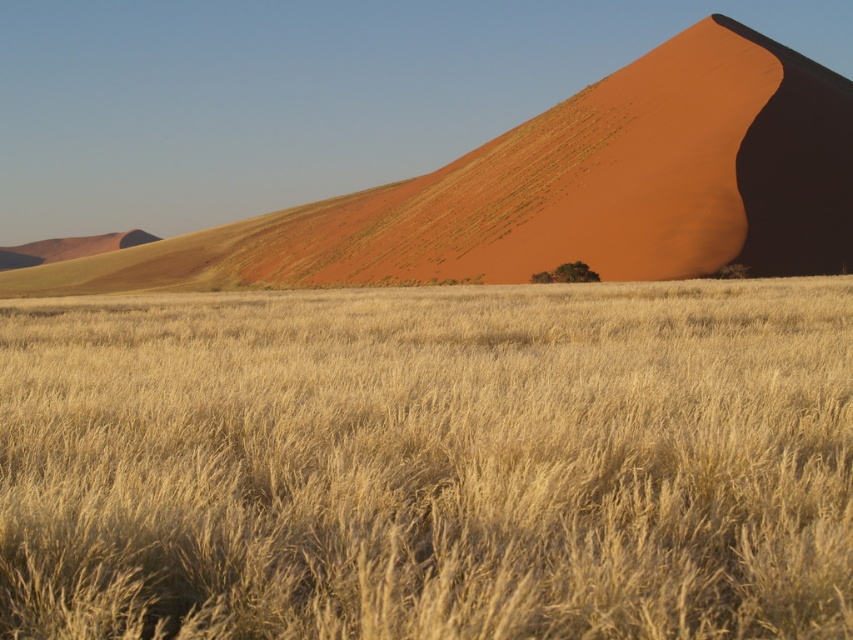
Does golden grass at center appear under smooth sand dune at upper right?

Yes.

Who is more forward, (x=44, y=396) or (x=477, y=209)?

Point (x=44, y=396) is more forward.

Between point (628, 317) and point (509, 154), which one is positioned in front?

Point (628, 317) is more forward.

At what (x,y) coordinates should I click in order to perform the action: click on golden grass at center. Please return your answer as a coordinate pair (x, y). This screenshot has height=640, width=853. Looking at the image, I should click on (430, 461).